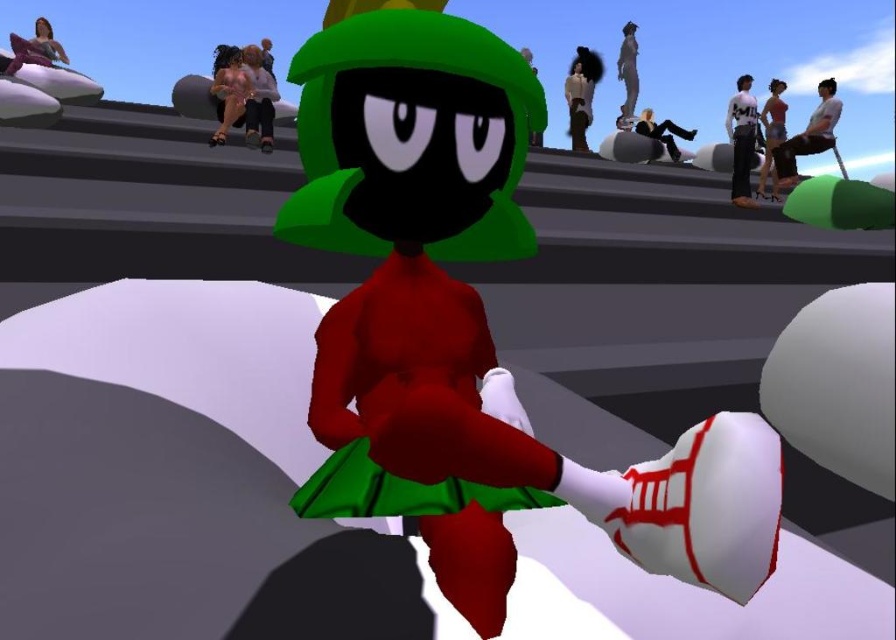
Looking at this image, you are a stunt performer who needs to jump from the white matte jacket at upper center to the smooth gray statue at upper right. Can you make the jump if your maximum jump distance is 1.7 meters?

The distance between the white matte jacket at upper center and the smooth gray statue at upper right is 1.80 meters, which is slightly longer than your maximum jump distance of 1.7 meters. Therefore, you cannot make the jump safely.

You are a character in this scene and want to grab the white matte jacket at upper center. However, there is a smooth gray statue at upper right in the way. Can you reach the jacket without moving the statue?

The white matte jacket at upper center is located below the smooth gray statue at upper right, so you can reach it without moving the statue.